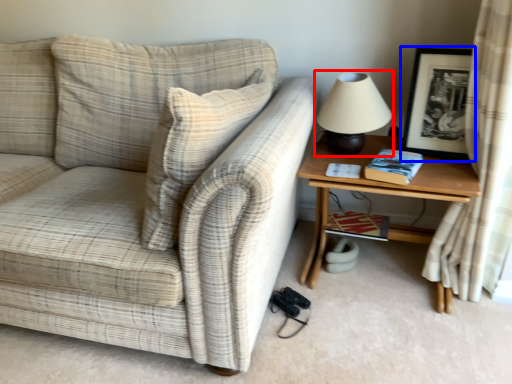
Question: Which object appears farthest to the camera in this image, table lamp (highlighted by a red box) or picture frame (highlighted by a blue box)?

Choices:
 (A) table lamp
 (B) picture frame

Answer: (A)